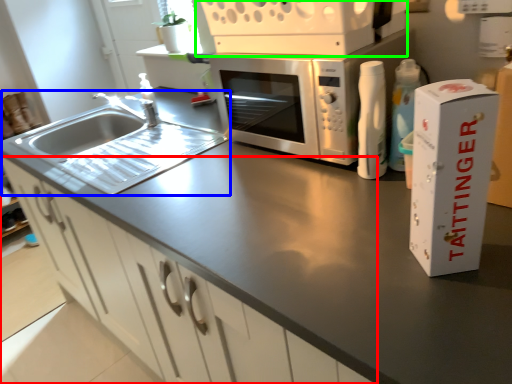
Question: Estimate the real-world distances between objects in this image. Which object is closer to cabinetry (highlighted by a red box), sink (highlighted by a blue box) or appliance (highlighted by a green box)?

Choices:
 (A) sink
 (B) appliance

Answer: (A)